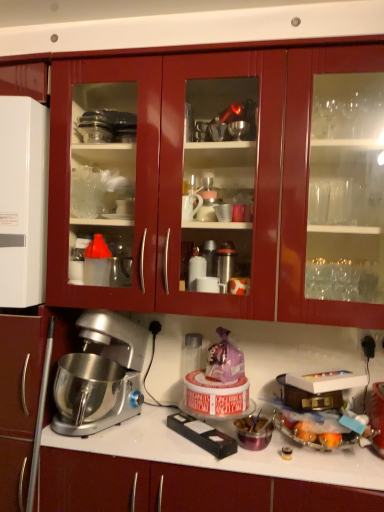
Question: Is white glossy refrigerator at left, which appears as the 1th appliance when viewed from the left, smaller than satin silver countertop at center?

Choices:
 (A) yes
 (B) no

Answer: (A)

Question: Can you confirm if white glossy refrigerator at left, which is the 2th appliance in right-to-left order, is wider than satin silver countertop at center?

Choices:
 (A) yes
 (B) no

Answer: (B)

Question: Does white glossy refrigerator at left, which is the 2th appliance in right-to-left order, have a larger size compared to satin silver countertop at center?

Choices:
 (A) yes
 (B) no

Answer: (B)

Question: From a real-world perspective, is white glossy refrigerator at left, which appears as the first appliance when viewed from the top, positioned under satin silver countertop at center based on gravity?

Choices:
 (A) yes
 (B) no

Answer: (B)

Question: Is white glossy refrigerator at left, which appears as the first appliance when viewed from the top, oriented away from satin silver countertop at center?

Choices:
 (A) no
 (B) yes

Answer: (A)

Question: From a real-world perspective, is satin silver countertop at center physically located above or below translucent plastic container at lower right, positioned as the second appliance in left-to-right order?

Choices:
 (A) below
 (B) above

Answer: (A)

Question: Is satin silver countertop at center inside or outside of translucent plastic container at lower right, the 1th appliance positioned from the bottom?

Choices:
 (A) inside
 (B) outside

Answer: (B)

Question: Is satin silver countertop at center taller or shorter than translucent plastic container at lower right, the 1th appliance positioned from the bottom?

Choices:
 (A) short
 (B) tall

Answer: (B)

Question: In terms of width, does satin silver countertop at center look wider or thinner when compared to translucent plastic container at lower right, the 1th appliance positioned from the bottom?

Choices:
 (A) thin
 (B) wide

Answer: (B)

Question: Considering the positions of black plastic electrical outlet at upper right and glossy wood cabinets at upper center in the image, is black plastic electrical outlet at upper right taller or shorter than glossy wood cabinets at upper center?

Choices:
 (A) tall
 (B) short

Answer: (B)

Question: Considering the relative positions of black plastic electrical outlet at upper right and glossy wood cabinets at upper center in the image provided, is black plastic electrical outlet at upper right to the left or to the right of glossy wood cabinets at upper center?

Choices:
 (A) right
 (B) left

Answer: (A)

Question: Is black plastic electrical outlet at upper right inside or outside of glossy wood cabinets at upper center?

Choices:
 (A) inside
 (B) outside

Answer: (B)

Question: Is point (365, 331) positioned closer to the camera than point (296, 145)?

Choices:
 (A) closer
 (B) farther

Answer: (B)

Question: Is satin silver countertop at center to the left or to the right of silver metallic mixer at lower left in the image?

Choices:
 (A) right
 (B) left

Answer: (A)

Question: In terms of width, does satin silver countertop at center look wider or thinner when compared to silver metallic mixer at lower left?

Choices:
 (A) thin
 (B) wide

Answer: (A)